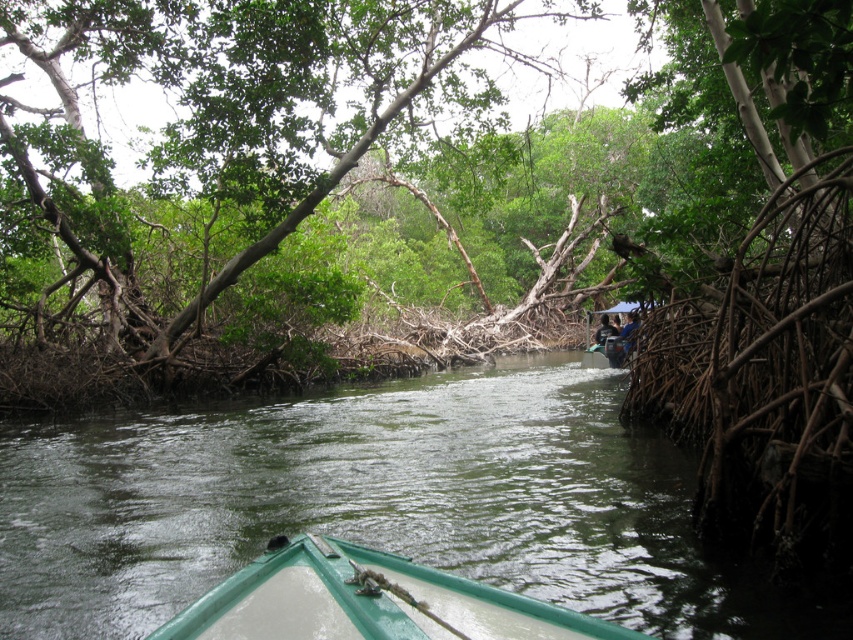
Is green leafy tree at center above green matte boat at center?

Indeed, green leafy tree at center is positioned over green matte boat at center.

This screenshot has width=853, height=640. Find the location of `green leafy tree at center`. green leafy tree at center is located at coordinates (374, 182).

Does green rubber boat at center lie behind green matte boat at center?

Yes, it is.

What do you see at coordinates (379, 502) in the screenshot? The width and height of the screenshot is (853, 640). I see `green rubber boat at center` at bounding box center [379, 502].

Locate an element on the screen. The height and width of the screenshot is (640, 853). green rubber boat at center is located at coordinates (379, 502).

Does green leafy tree at center have a greater height compared to green rubber boat at center?

Yes, green leafy tree at center is taller than green rubber boat at center.

Consider the image. Who is lower down, green leafy tree at center or green rubber boat at center?

green rubber boat at center is below.

Is point (167, 285) positioned in front of point (619, 388)?

No, (167, 285) is further to viewer.

At what (x,y) coordinates should I click in order to perform the action: click on green leafy tree at center. Please return your answer as a coordinate pair (x, y). Looking at the image, I should click on (374, 182).